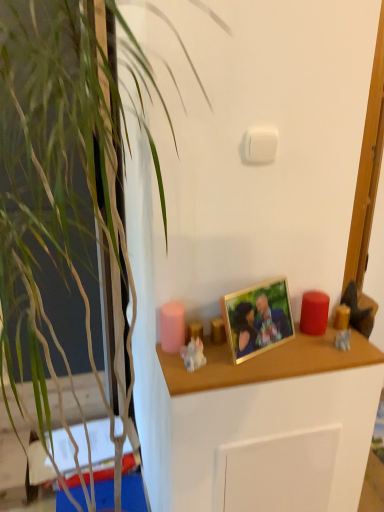
You are a GUI agent. You are given a task and a screenshot of the screen. Output one action in this format:
    pyautogui.click(x=<x>, y=<y>)
    Task: Click on the vacant region to the right of gold metallic picture frame at center
    The width and height of the screenshot is (384, 512).
    Given the screenshot: What is the action you would take?
    pyautogui.click(x=332, y=352)